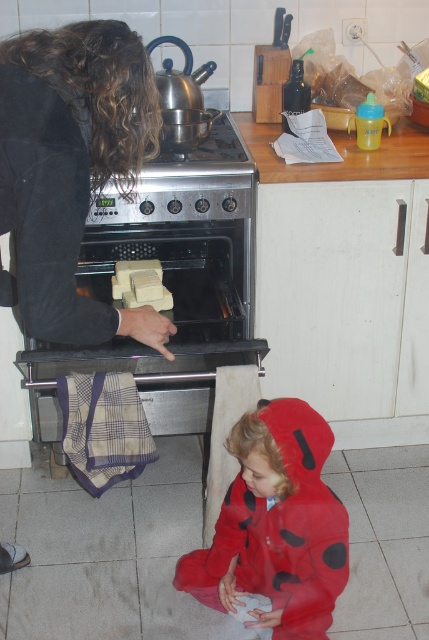
Can you confirm if stainless steel oven at center is taller than red fuzzy coat at lower center?

Indeed, stainless steel oven at center has a greater height compared to red fuzzy coat at lower center.

Is stainless steel oven at center to the right of red fuzzy coat at lower center from the viewer's perspective?

Incorrect, stainless steel oven at center is not on the right side of red fuzzy coat at lower center.

Describe the element at coordinates (169, 284) in the screenshot. I see `stainless steel oven at center` at that location.

Where is `stainless steel oven at center`? This screenshot has height=640, width=429. stainless steel oven at center is located at coordinates (169, 284).

Measure the distance between point (307, 625) and camera.

Point (307, 625) is 5.43 feet from camera.

Is red fuzzy coat at lower center below yellow soft cheese at oven center?

Indeed, red fuzzy coat at lower center is positioned under yellow soft cheese at oven center.

Who is more forward, (296, 531) or (151, 282)?

Point (296, 531) is in front.

Where is `red fuzzy coat at lower center`? Image resolution: width=429 pixels, height=640 pixels. red fuzzy coat at lower center is located at coordinates (275, 525).

Between stainless steel oven at center and yellow soft cheese at oven center, which one is positioned lower?

stainless steel oven at center is below.

Does point (153, 170) come behind point (129, 276)?

No.

The height and width of the screenshot is (640, 429). I want to click on stainless steel oven at center, so click(x=169, y=284).